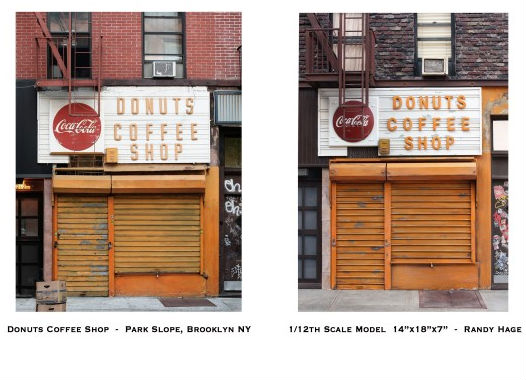
The image size is (526, 380). I want to click on light, so click(22, 188).